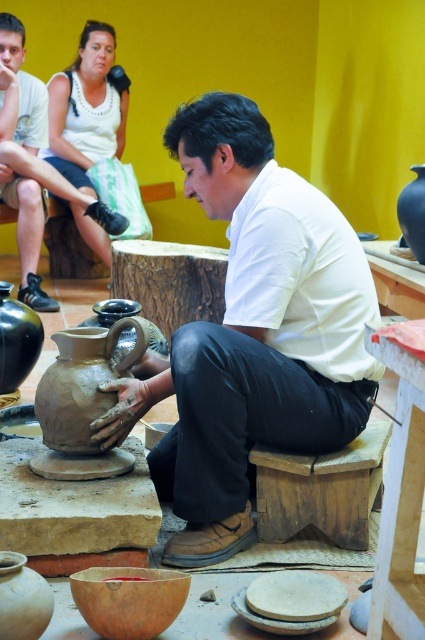
Is point (22, 269) positioned in front of point (99, 336)?

No, (22, 269) is further to viewer.

Is matte clay pot at center smaller than matte clay pitcher at center?

No, matte clay pot at center is not smaller than matte clay pitcher at center.

Is point (79, 205) behind point (45, 420)?

That is True.

You are a GUI agent. You are given a task and a screenshot of the screen. Output one action in this format:
    pyautogui.click(x=<x>, y=<y>)
    Task: Click on the matte clay pot at center
    This screenshot has width=425, height=640.
    Given the screenshot: What is the action you would take?
    pyautogui.click(x=31, y=163)

Does point (268, 538) come closer to viewer compared to point (5, 301)?

Yes.

Is point (257, 484) positioned after point (2, 360)?

No, (257, 484) is closer to viewer.

Identify the location of wooden stool at center. This screenshot has width=425, height=640. (320, 490).

From the picture: Can you confirm if matte clay pot at lower left is positioned to the left of matte black vase at left?

No, matte clay pot at lower left is not to the left of matte black vase at left.

Locate an element on the screen. Image resolution: width=425 pixels, height=640 pixels. matte clay pot at lower left is located at coordinates (22, 598).